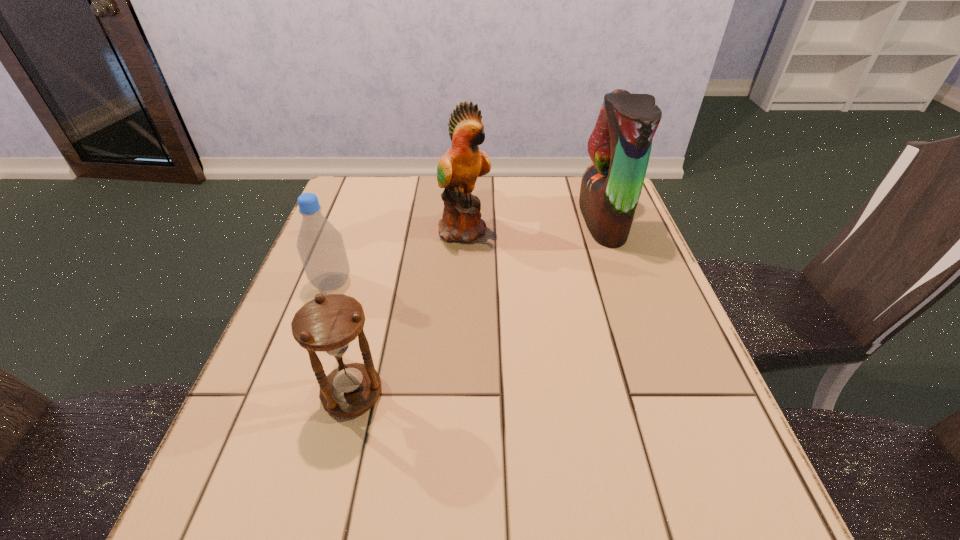
In order to click on vacant region located 0.140m on the right of the leftmost object in this screenshot , I will do `click(414, 283)`.

Find the location of a particular element. Image resolution: width=960 pixels, height=540 pixels. free region located on the back of the third object from right to left is located at coordinates (383, 272).

The height and width of the screenshot is (540, 960). I want to click on bottle that is at the left edge, so click(x=320, y=245).

Find the location of a particular element. Image resolution: width=960 pixels, height=540 pixels. hourglass located in the left edge section of the desktop is located at coordinates (329, 324).

Identify the location of object that is at the right edge. (620, 145).

Identify the location of object at the far right corner. The width and height of the screenshot is (960, 540). (620, 145).

You are a GUI agent. You are given a task and a screenshot of the screen. Output one action in this format:
    pyautogui.click(x=<x>, y=<y>)
    Task: Click on the free space at the far edge
    This screenshot has width=960, height=540.
    Given the screenshot: What is the action you would take?
    pyautogui.click(x=514, y=180)

In the image, there is a desktop. Where is `free space at the near edge`? Image resolution: width=960 pixels, height=540 pixels. free space at the near edge is located at coordinates (423, 511).

I want to click on free space at the left edge of the desktop, so click(x=279, y=349).

Where is `vacant space at the right edge of the desktop`? vacant space at the right edge of the desktop is located at coordinates (626, 258).